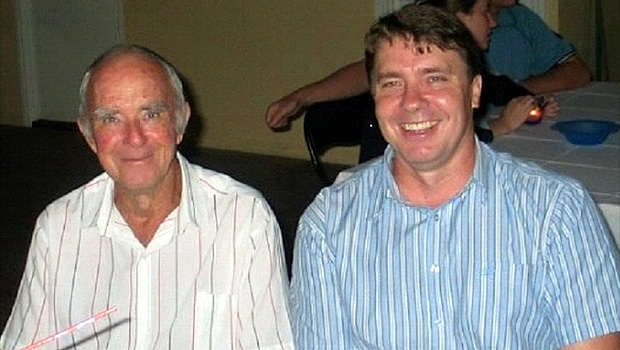
Locate an element on the screen. The image size is (620, 350). table is located at coordinates (594, 169).